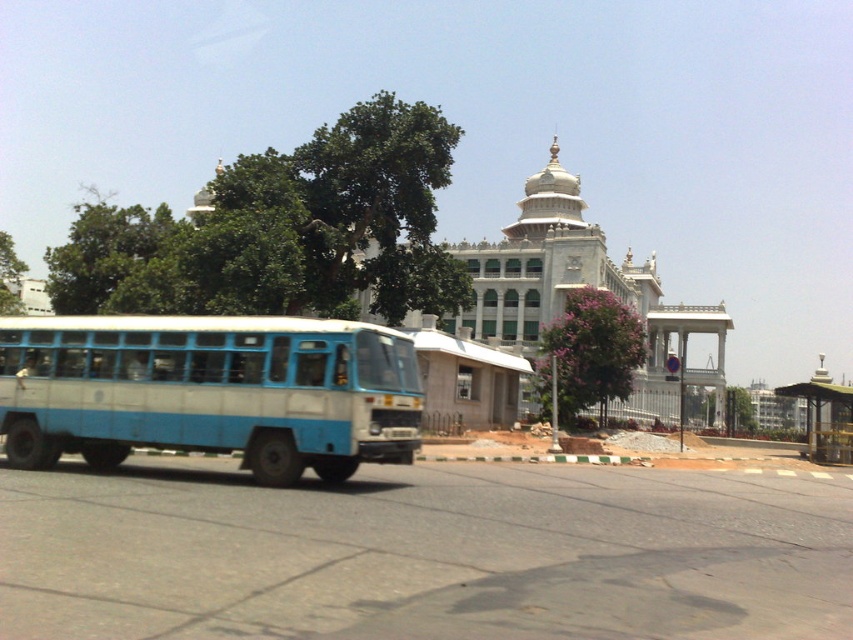
Is white marble palace at center closer to the viewer compared to metallic green bus stop at lower right?

No, it is behind metallic green bus stop at lower right.

Who is shorter, white marble palace at center or metallic green bus stop at lower right?

metallic green bus stop at lower right

Locate an element on the screen. white marble palace at center is located at coordinates (577, 288).

Between blue matte bus at left and metallic green bus stop at lower right, which one appears on the right side from the viewer's perspective?

metallic green bus stop at lower right is more to the right.

Is blue matte bus at left above metallic green bus stop at lower right?

Yes, blue matte bus at left is above metallic green bus stop at lower right.

Between point (230, 435) and point (844, 428), which one is positioned in front?

Positioned in front is point (230, 435).

The image size is (853, 640). Find the location of `blue matte bus at left`. blue matte bus at left is located at coordinates (209, 392).

Between blue matte bus at left and white marble palace at center, which one appears on the right side from the viewer's perspective?

Positioned to the right is white marble palace at center.

Between point (70, 362) and point (471, 333), which one is positioned in front?

Positioned in front is point (70, 362).

This screenshot has width=853, height=640. Identify the location of blue matte bus at left. (209, 392).